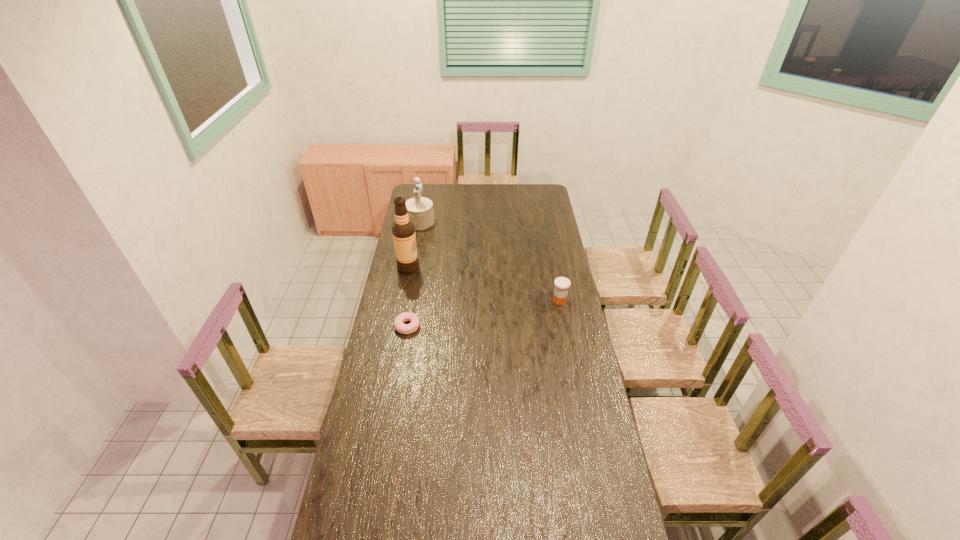
This screenshot has height=540, width=960. What are the coordinates of `the shortest object` in the screenshot? It's located at (399, 325).

I want to click on doughnut, so click(399, 325).

This screenshot has height=540, width=960. Identify the location of the third tallest object. [x=562, y=284].

This screenshot has height=540, width=960. Find the location of `the rightmost object`. the rightmost object is located at coordinates (562, 284).

The image size is (960, 540). Find the location of `the farthest object`. the farthest object is located at coordinates (420, 209).

Find the location of `the third shortest object`. the third shortest object is located at coordinates (420, 209).

Where is `alcohol`? This screenshot has height=540, width=960. alcohol is located at coordinates (403, 230).

The width and height of the screenshot is (960, 540). In order to click on the tallest object in this screenshot , I will do `click(403, 230)`.

Identify the location of blank area located 0.390m on the front of the shortest object. (393, 413).

Identify the location of free space located at the beak of the figurine. (433, 235).